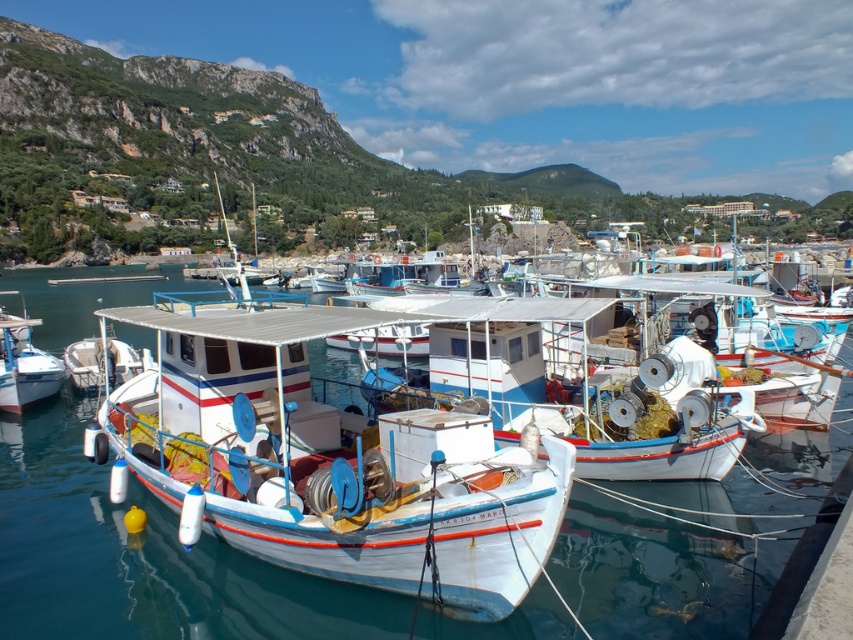
Can you confirm if transparent blue water at center is shorter than white glossy boat at left?

Incorrect, transparent blue water at center's height does not fall short of white glossy boat at left's.

Is transparent blue water at center thinner than white glossy boat at left?

No.

Where is `transparent blue water at center`? This screenshot has width=853, height=640. transparent blue water at center is located at coordinates (141, 556).